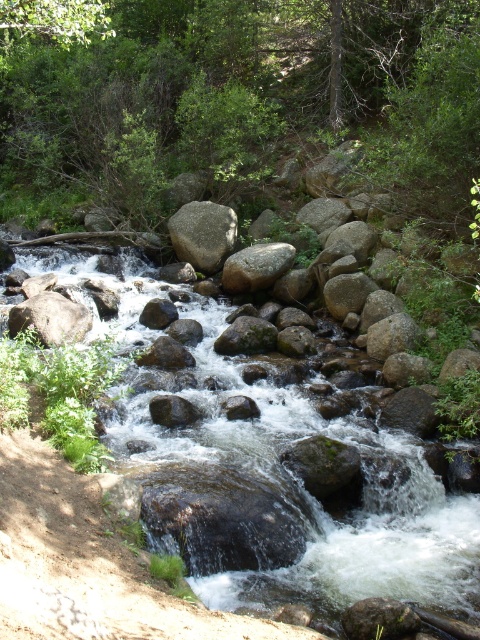
Who is shorter, gray rock at center or smooth gray rock at center?

smooth gray rock at center

Can you confirm if gray rock at center is positioned below smooth gray rock at center?

No, gray rock at center is not below smooth gray rock at center.

Locate an element on the screen. The image size is (480, 640). gray rock at center is located at coordinates (204, 234).

Between smooth rock stream at center and gray rock at left, which one is positioned lower?

smooth rock stream at center

Between smooth rock stream at center and gray rock at left, which one is positioned higher?

gray rock at left is higher up.

Does point (12, 420) lie in front of point (84, 330)?

Yes, it is.

This screenshot has width=480, height=640. What are the coordinates of `smooth rock stream at center` in the screenshot? It's located at click(241, 476).

Between gray rock at center and gray rough rock at center, which one has less height?

gray rough rock at center

Can you confirm if gray rock at center is bigger than gray rough rock at center?

Yes.

Does point (222, 234) lie in front of point (252, 252)?

No.

What are the coordinates of `gray rock at center` in the screenshot? It's located at (204, 234).